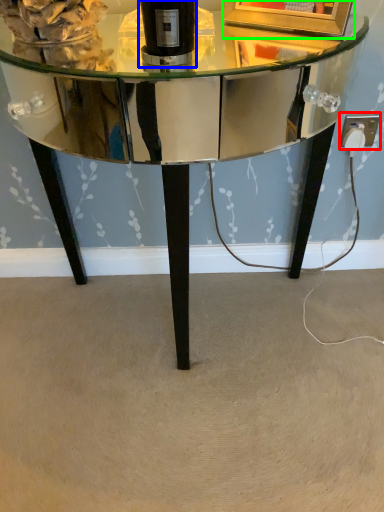
Question: Considering the real-world distances, which object is closest to electric outlet (highlighted by a red box)? bottle (highlighted by a blue box) or picture frame (highlighted by a green box).

Choices:
 (A) bottle
 (B) picture frame

Answer: (B)